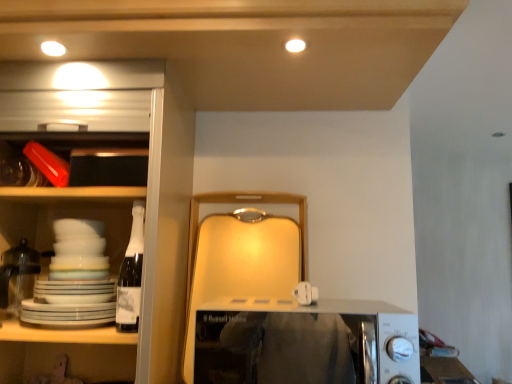
Question: Would you say white glossy cabinet at left is to the left or to the right of white plastic microwave at center in the picture?

Choices:
 (A) left
 (B) right

Answer: (A)

Question: Is white glossy cabinet at left wider or thinner than white plastic microwave at center?

Choices:
 (A) wide
 (B) thin

Answer: (A)

Question: Would you say white glossy cabinet at left is inside or outside white plastic microwave at center?

Choices:
 (A) inside
 (B) outside

Answer: (B)

Question: From a real-world perspective, is white plastic microwave at center above or below white glossy cabinet at left?

Choices:
 (A) below
 (B) above

Answer: (A)

Question: In the image, is white plastic microwave at center positioned in front of or behind white glossy cabinet at left?

Choices:
 (A) front
 (B) behind

Answer: (A)

Question: Is white plastic microwave at center to the left or to the right of white glossy cabinet at left in the image?

Choices:
 (A) left
 (B) right

Answer: (B)

Question: Is white plastic microwave at center inside or outside of white glossy cabinet at left?

Choices:
 (A) outside
 (B) inside

Answer: (A)